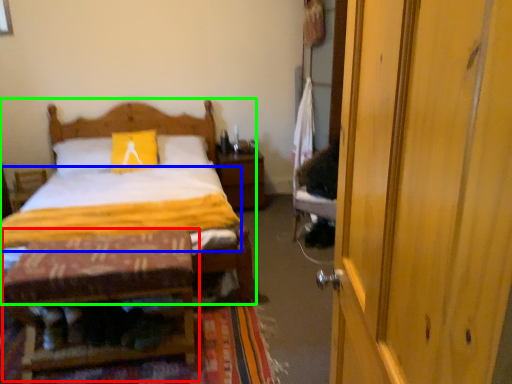
Question: Which object is positioned farthest from table (highlighted by a red box)? Select from quilt (highlighted by a blue box) and bed (highlighted by a green box).

Choices:
 (A) quilt
 (B) bed

Answer: (B)